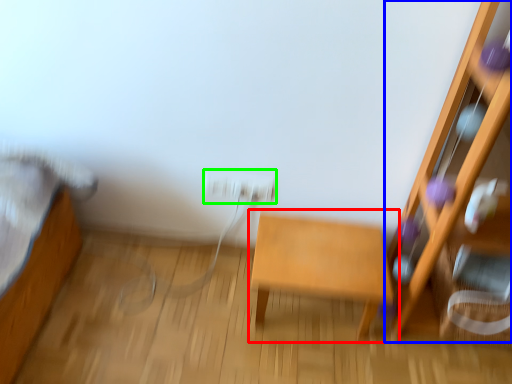
Question: Estimate the real-world distances between objects in this image. Which object is farther from table (highlighted by a red box), furniture (highlighted by a blue box) or electric outlet (highlighted by a green box)?

Choices:
 (A) furniture
 (B) electric outlet

Answer: (A)